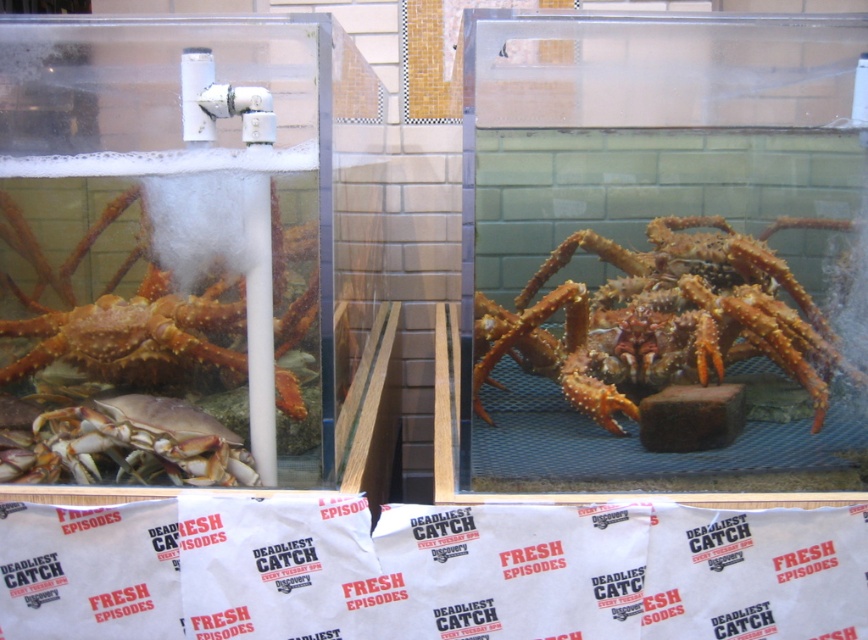
Can you confirm if spiny orange crab at center is positioned to the left of shiny orange crab at left?

In fact, spiny orange crab at center is to the right of shiny orange crab at left.

Does spiny orange crab at center have a lesser width compared to shiny orange crab at left?

Incorrect, spiny orange crab at center's width is not less than shiny orange crab at left's.

You are a GUI agent. You are given a task and a screenshot of the screen. Output one action in this format:
    pyautogui.click(x=<x>, y=<y>)
    Task: Click on the spiny orange crab at center
    This screenshot has height=640, width=868.
    Given the screenshot: What is the action you would take?
    pyautogui.click(x=659, y=320)

From the picture: Is shiny orange crab at left smaller than smooth beige crab at left?

Actually, shiny orange crab at left might be larger than smooth beige crab at left.

How much distance is there between shiny orange crab at left and smooth beige crab at left?

shiny orange crab at left is 8.37 inches away from smooth beige crab at left.

The width and height of the screenshot is (868, 640). Identify the location of shiny orange crab at left. (122, 310).

Who is higher up, spiny orange crab at center or smooth beige crab at left?

spiny orange crab at center is above.

Locate an element on the screen. This screenshot has height=640, width=868. spiny orange crab at center is located at coordinates (659, 320).

Where is `spiny orange crab at center`? This screenshot has width=868, height=640. spiny orange crab at center is located at coordinates pyautogui.click(x=659, y=320).